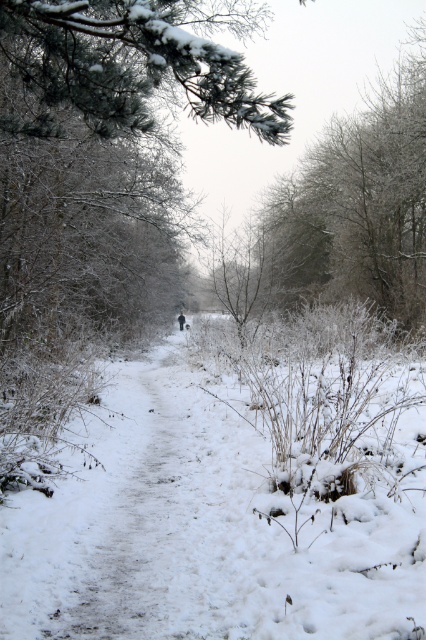
You are a hiker who wants to take a photo of the white fluffy snow at center and the green textured pine branch at upper left. Which object will appear closer to the camera in the photo?

The white fluffy snow at center will appear closer to the camera in the photo because it is in front of the green textured pine branch at upper left.

You are standing at the starting point of the snow path and see two points marked on the path. The first point is at coordinate point (x=371, y=634) and the second is at point (x=224, y=97). If you walk along the path towards the end, which point will you encounter first?

You will encounter point (x=371, y=634) first because it is in front of point (x=224, y=97) along the path.